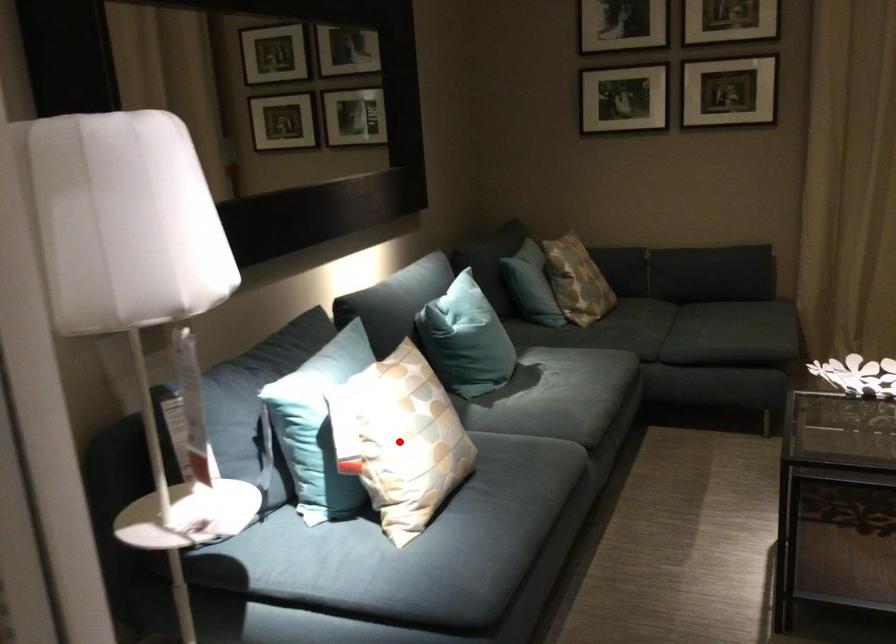
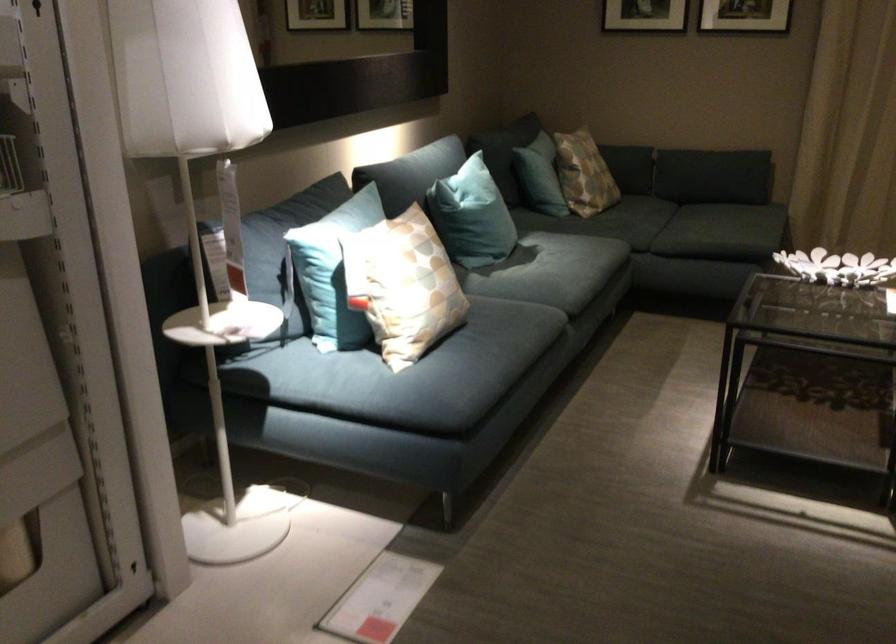
Question: I am providing you with two images of the same scene from different viewpoints. In image1, a red point is highlighted. Considering the same 3D point in image2, which of the following is correct?

Choices:
 (A) It is closer
 (B) It is farther

Answer: (B)